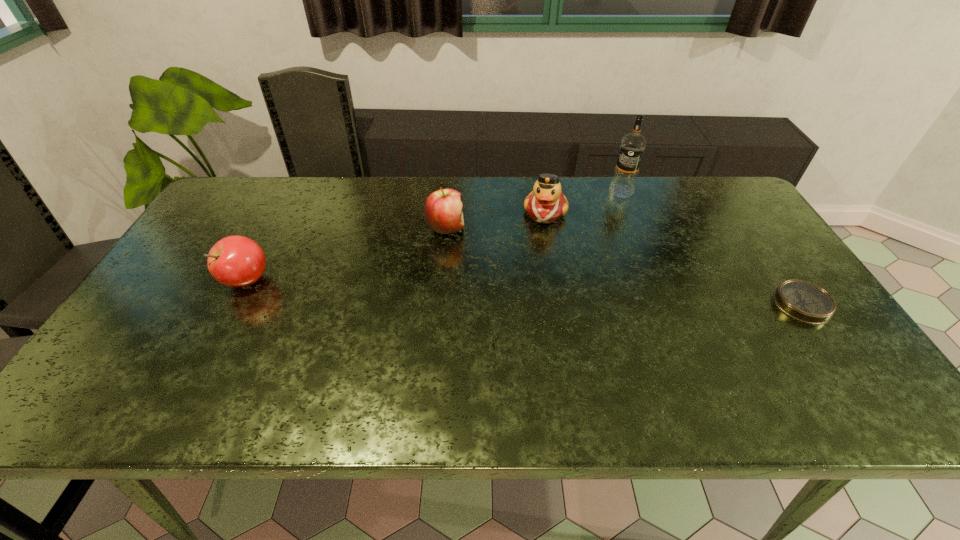
The width and height of the screenshot is (960, 540). I want to click on free space on the desktop that is between the leftmost object and the rightmost object and is positioned on the face of the third object from left to right, so click(x=532, y=293).

The height and width of the screenshot is (540, 960). Identify the location of free spot on the desktop that is between the nearer apple and the compass and is positioned on the label of the second object from right to left. (559, 294).

Where is `vacant space on the desktop that is between the leftmost object and the rightmost object and is positioned on the bitten side of the second object from left to right`? This screenshot has height=540, width=960. vacant space on the desktop that is between the leftmost object and the rightmost object and is positioned on the bitten side of the second object from left to right is located at coordinates (569, 294).